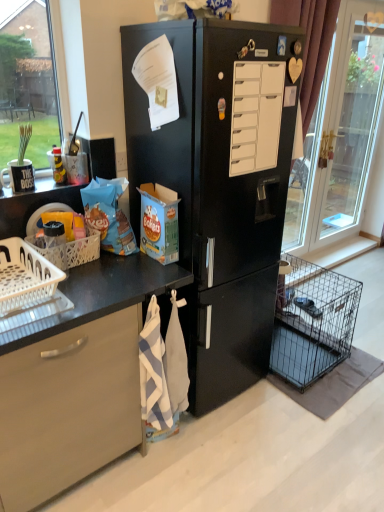
Question: From the image's perspective, is black matte refrigerator at center beneath white striped towel at lower center?

Choices:
 (A) yes
 (B) no

Answer: (B)

Question: From a real-world perspective, is black matte refrigerator at center positioned under white striped towel at lower center based on gravity?

Choices:
 (A) no
 (B) yes

Answer: (A)

Question: Considering the relative sizes of black matte refrigerator at center and white striped towel at lower center in the image provided, is black matte refrigerator at center thinner than white striped towel at lower center?

Choices:
 (A) yes
 (B) no

Answer: (B)

Question: Is black matte refrigerator at center next to white striped towel at lower center and touching it?

Choices:
 (A) yes
 (B) no

Answer: (B)

Question: Is black matte refrigerator at center smaller than white striped towel at lower center?

Choices:
 (A) no
 (B) yes

Answer: (A)

Question: From the image's perspective, is black matte refrigerator at center on top of white striped towel at lower center?

Choices:
 (A) no
 (B) yes

Answer: (B)

Question: Considering the relative sizes of white plastic basket at lower left, the 2th basket in the front-to-back sequence, and white matte drawer at center in the image provided, is white plastic basket at lower left, the 2th basket in the front-to-back sequence, taller than white matte drawer at center?

Choices:
 (A) yes
 (B) no

Answer: (B)

Question: From a real-world perspective, is white plastic basket at lower left, the 1th basket when ordered from back to front, positioned over white matte drawer at center based on gravity?

Choices:
 (A) yes
 (B) no

Answer: (B)

Question: Is white plastic basket at lower left, the 1th basket when ordered from back to front, next to white matte drawer at center and touching it?

Choices:
 (A) no
 (B) yes

Answer: (A)

Question: Does white plastic basket at lower left, the 1th basket when ordered from back to front, have a larger size compared to white matte drawer at center?

Choices:
 (A) yes
 (B) no

Answer: (A)

Question: Is white plastic basket at lower left, the 2th basket in the front-to-back sequence, smaller than white matte drawer at center?

Choices:
 (A) no
 (B) yes

Answer: (A)

Question: From the image's perspective, is white plastic basket at lower left, the 2th basket in the front-to-back sequence, over white matte drawer at center?

Choices:
 (A) yes
 (B) no

Answer: (B)

Question: Can you confirm if black wire dog crate at lower right is taller than white striped towel at lower center?

Choices:
 (A) no
 (B) yes

Answer: (A)